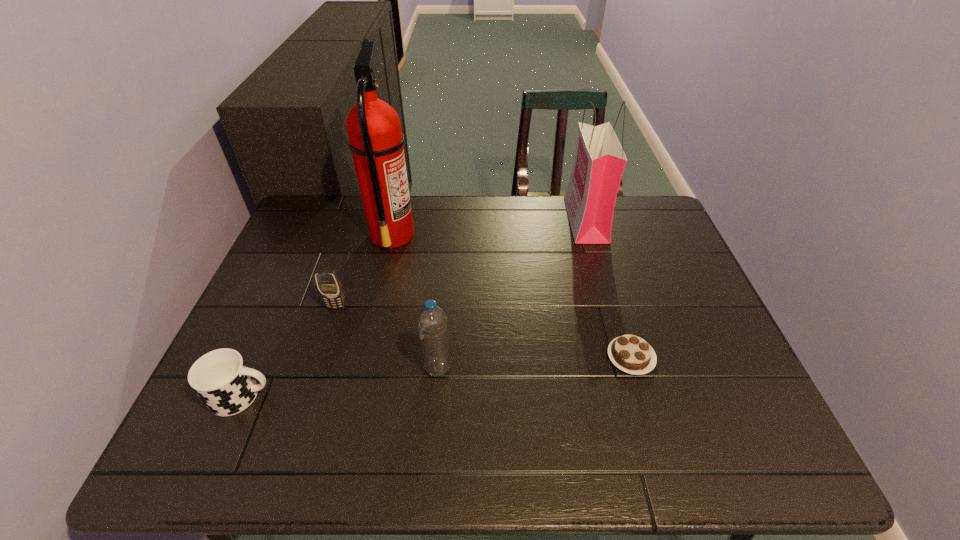
What are the coordinates of `free space that satisfies the following two spatial constraints: 1. on the side of the tallest object near the handle; 2. on the front face of the cellular telephone` in the screenshot? It's located at (375, 307).

This screenshot has height=540, width=960. Identify the location of vacant space that satisfies the following two spatial constraints: 1. on the side of the water bottle near the handle; 2. on the left side of the tallest object. (362, 368).

Find the location of `vacant area that satisfies the following two spatial constraints: 1. on the side of the fourth shortest object near the handle; 2. on the right side of the third object from left to right`. vacant area that satisfies the following two spatial constraints: 1. on the side of the fourth shortest object near the handle; 2. on the right side of the third object from left to right is located at coordinates (362, 368).

Locate an element on the screen. This screenshot has height=540, width=960. vacant space that satisfies the following two spatial constraints: 1. on the front-facing side of the shopping bag; 2. on the back side of the chocolate cake is located at coordinates [x=625, y=357].

You are a GUI agent. You are given a task and a screenshot of the screen. Output one action in this format:
    pyautogui.click(x=<x>, y=<y>)
    Task: Click on the free location that satisfies the following two spatial constraints: 1. on the front face of the third farthest object; 2. on the right side of the chocolate cake
    The width and height of the screenshot is (960, 540).
    Given the screenshot: What is the action you would take?
    pyautogui.click(x=321, y=357)

Where is `vacant space that satisfies the following two spatial constraints: 1. on the front-facing side of the chocolate cake; 2. on the left side of the second tallest object`? The height and width of the screenshot is (540, 960). vacant space that satisfies the following two spatial constraints: 1. on the front-facing side of the chocolate cake; 2. on the left side of the second tallest object is located at coordinates (625, 357).